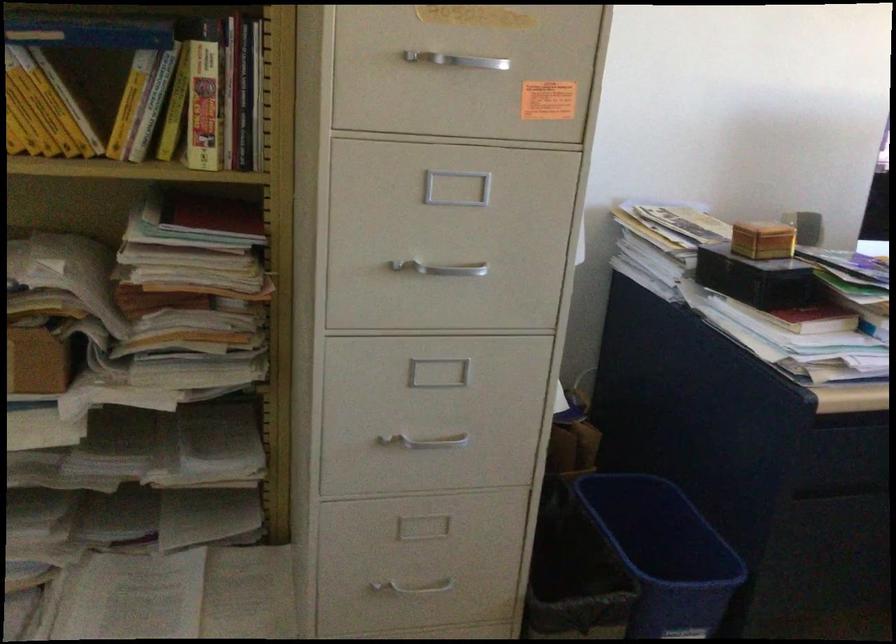
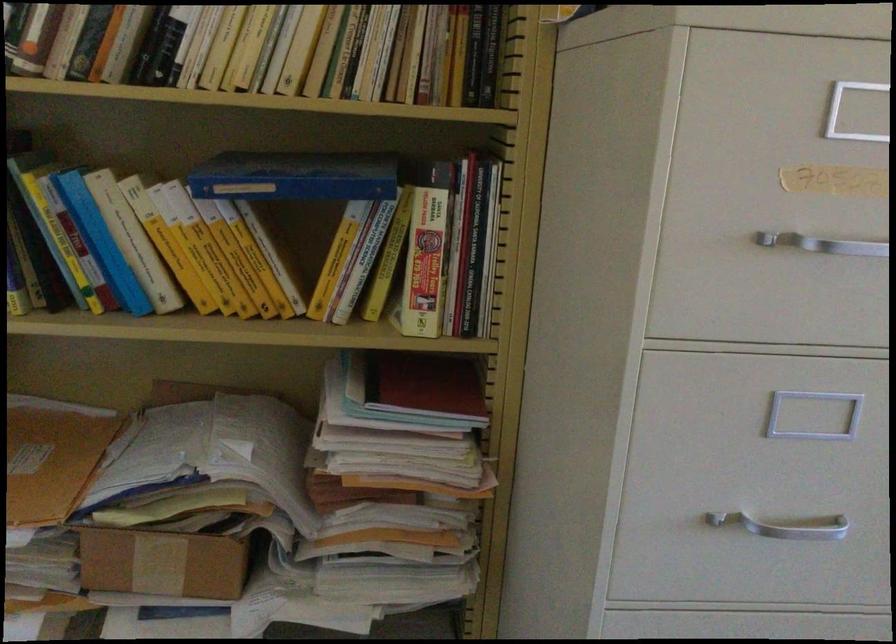
Find the pixel in the second image that matches pixel 453 270 in the first image.

(784, 526)